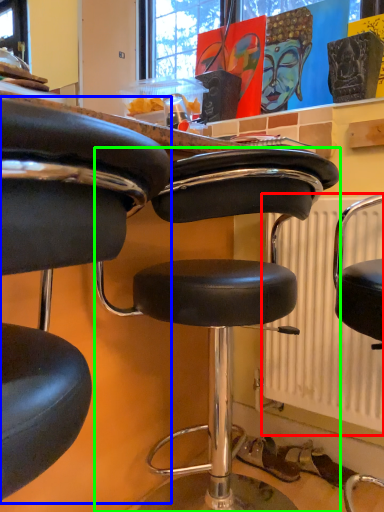
Question: Which is nearer to the radiator (highlighted by a red box)? chair (highlighted by a blue box) or chair (highlighted by a green box).

Choices:
 (A) chair
 (B) chair

Answer: (B)